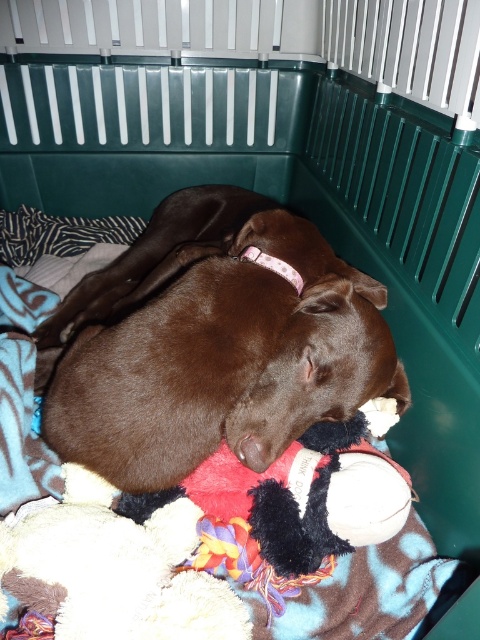
Does point (128, 476) come behind point (12, 392)?

No, it is not.

Is brown smooth dog at center positioned before soft plush dog bed at center?

Yes, brown smooth dog at center is in front of soft plush dog bed at center.

Identify the location of brown smooth dog at center. coord(225,360).